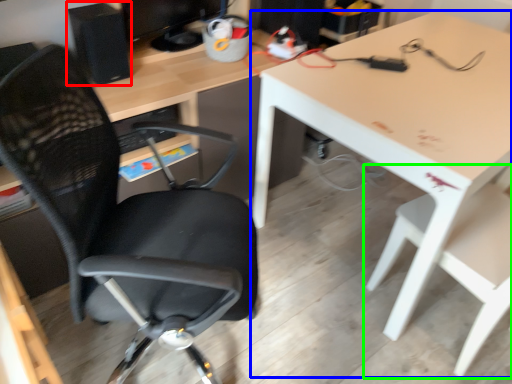
Question: Which is farther away from computer tower (highlighted by a red box)? table (highlighted by a blue box) or chair (highlighted by a green box)?

Choices:
 (A) table
 (B) chair

Answer: (B)